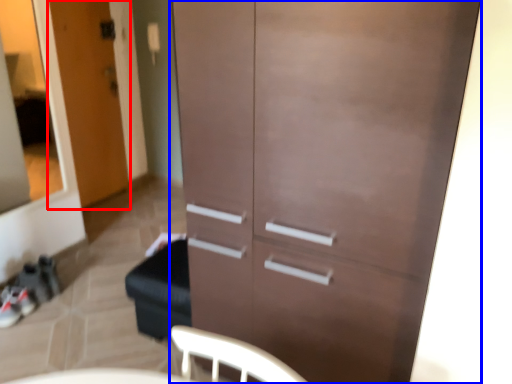
Question: Which object is closer to the camera taking this photo, door (highlighted by a red box) or cupboard (highlighted by a blue box)?

Choices:
 (A) door
 (B) cupboard

Answer: (B)